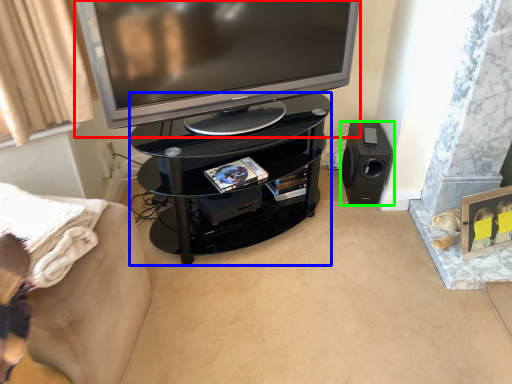
Question: Estimate the real-world distances between objects in this image. Which object is closer to television (highlighted by a red box), tv cabinet (highlighted by a blue box) or loudspeaker (highlighted by a green box)?

Choices:
 (A) tv cabinet
 (B) loudspeaker

Answer: (A)